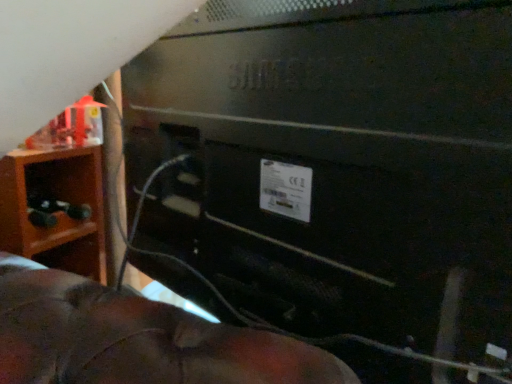
Question: Considering the relative sizes of black matte wire at center and matte black toy at left in the image provided, is black matte wire at center thinner than matte black toy at left?

Choices:
 (A) no
 (B) yes

Answer: (B)

Question: Are black matte wire at center and matte black toy at left located far from each other?

Choices:
 (A) yes
 (B) no

Answer: (B)

Question: From the image's perspective, is black matte wire at center on matte black toy at left?

Choices:
 (A) yes
 (B) no

Answer: (A)

Question: Is black matte wire at center positioned before matte black toy at left?

Choices:
 (A) no
 (B) yes

Answer: (B)

Question: Is black matte wire at center at the left side of matte black toy at left?

Choices:
 (A) yes
 (B) no

Answer: (B)

Question: From a real-world perspective, relative to brown wood nightstand at left, is matte black toy at left vertically above or below?

Choices:
 (A) below
 (B) above

Answer: (B)

Question: From the image's perspective, relative to brown wood nightstand at left, is matte black toy at left above or below?

Choices:
 (A) below
 (B) above

Answer: (B)

Question: In terms of width, does matte black toy at left look wider or thinner when compared to brown wood nightstand at left?

Choices:
 (A) wide
 (B) thin

Answer: (B)

Question: Would you say matte black toy at left is inside or outside brown wood nightstand at left?

Choices:
 (A) inside
 (B) outside

Answer: (A)

Question: Would you say black matte wire at center is inside or outside brown wood nightstand at left?

Choices:
 (A) outside
 (B) inside

Answer: (A)

Question: Is black matte wire at center in front of or behind brown wood nightstand at left in the image?

Choices:
 (A) front
 (B) behind

Answer: (A)

Question: Visually, is black matte wire at center positioned to the left or to the right of brown wood nightstand at left?

Choices:
 (A) left
 (B) right

Answer: (B)

Question: Based on their sizes in the image, would you say black matte wire at center is bigger or smaller than brown wood nightstand at left?

Choices:
 (A) small
 (B) big

Answer: (B)

Question: Is point (33, 238) positioned closer to the camera than point (440, 311)?

Choices:
 (A) farther
 (B) closer

Answer: (A)

Question: Considering the positions of brown wood nightstand at left and black matte wire at center in the image, is brown wood nightstand at left wider or thinner than black matte wire at center?

Choices:
 (A) thin
 (B) wide

Answer: (B)